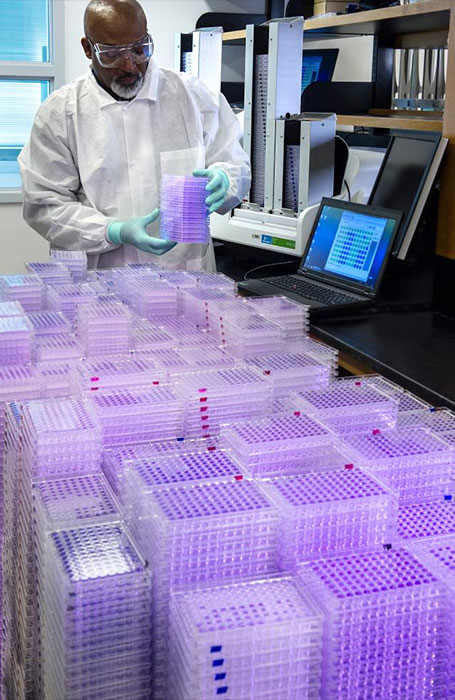
Where is `computer keyboard`? The image size is (455, 700). computer keyboard is located at coordinates (307, 292).